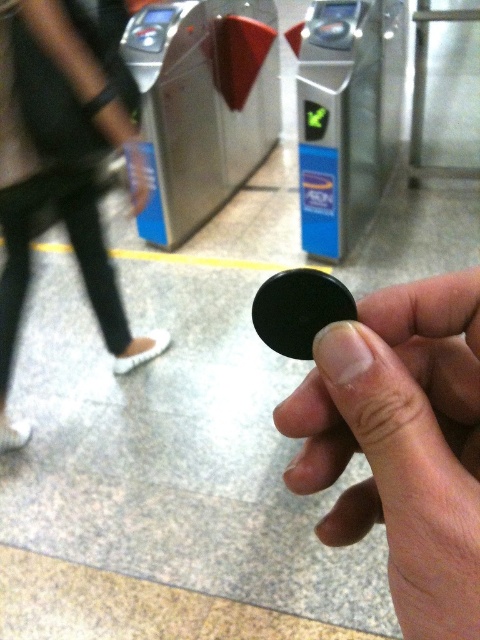
Does black matte coin at center have a larger size compared to black leather pants at lower left?

No, black matte coin at center is not bigger than black leather pants at lower left.

Between point (396, 292) and point (20, 307), which one is positioned in front?

Point (396, 292)

This screenshot has width=480, height=640. Identify the location of black matte coin at center. (402, 444).